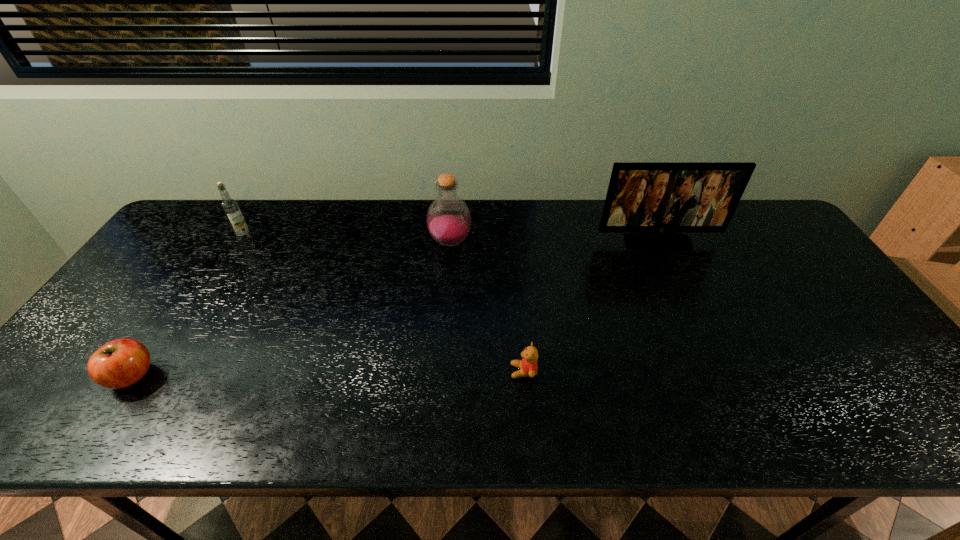
This screenshot has height=540, width=960. Find the location of `the tallest object`. the tallest object is located at coordinates (659, 199).

The image size is (960, 540). Identify the location of monitor. (659, 199).

You are a GUI agent. You are given a task and a screenshot of the screen. Output one action in this format:
    pyautogui.click(x=<x>, y=<y>)
    Task: Click on the third object from left to right
    This screenshot has width=960, height=540.
    Given the screenshot: What is the action you would take?
    pyautogui.click(x=448, y=218)

This screenshot has height=540, width=960. Identify the location of vodka. (230, 207).

Where is `apple`? apple is located at coordinates (120, 363).

Locate an element on the screen. The width and height of the screenshot is (960, 540). teddy bear is located at coordinates click(528, 365).

You are a GUI agent. You are given a task and a screenshot of the screen. Output one action in this format:
    pyautogui.click(x=<x>, y=<y>)
    Task: Click on the fourth object from left to right
    The width and height of the screenshot is (960, 540).
    Given the screenshot: What is the action you would take?
    pyautogui.click(x=528, y=365)

Identify the location of free location located 0.200m on the front-facing side of the rightmost object. The height and width of the screenshot is (540, 960). (683, 297).

In order to click on free space located on the front of the bottle in this screenshot , I will do `click(445, 303)`.

At what (x,y) coordinates should I click in order to perform the action: click on free space located 0.110m on the label of the vodka. Please return your answer as a coordinate pair (x, y). This screenshot has width=960, height=540. Looking at the image, I should click on (228, 266).